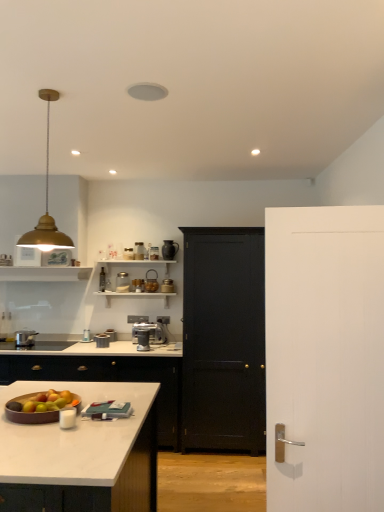
Measure the distance between point (65,238) and camera.

Point (65,238) and camera are 10.34 feet apart.

How much space does clear glass jar at upper center, marked as the fifth appliance in a right-to-left arrangement, occupy vertically?

It is 22.04 centimeters.

Identify the location of metallic silver toaster at upper center, positioned as the 8th appliance in right-to-left order. This screenshot has width=384, height=512. (102, 280).

What do you see at coordinates (44, 402) in the screenshot? The height and width of the screenshot is (512, 384). I see `green matte apple at lower left` at bounding box center [44, 402].

What is the approximate width of metallic silver canister at center, acting as the 7th appliance starting from the right?

5.71 inches.

This screenshot has width=384, height=512. What do you see at coordinates (102, 340) in the screenshot?
I see `metallic silver canister at center, which is the 2th appliance in left-to-right order` at bounding box center [102, 340].

Identify the location of metallic silver toaster at center, the 5th appliance viewed from the left. (128, 254).

Locate an element on the screen. metallic silver toaster at center, which appears as the 6th appliance when viewed from the right is located at coordinates (111, 334).

Find the location of `gold metallic pendant light at upper left`. gold metallic pendant light at upper left is located at coordinates (46, 203).

Which object is further away from the camera taking this photo, black wooden door at center, marked as the 1th door in a back-to-front arrangement, or green matte apple at lower left?

black wooden door at center, marked as the 1th door in a back-to-front arrangement, is more distant.

Does point (216, 253) come behind point (9, 409)?

Yes.

This screenshot has width=384, height=512. I want to click on apple that is on the left side of black wooden door at center, which is counted as the second door, starting from the front, so click(x=44, y=402).

In terms of width, does green matte apple at lower left look wider or thinner when compared to gold metallic pendant light at upper left?

Considering their sizes, green matte apple at lower left looks broader than gold metallic pendant light at upper left.

How many degrees apart are the facing directions of green matte apple at lower left and gold metallic pendant light at upper left?

The angle between the facing direction of green matte apple at lower left and the facing direction of gold metallic pendant light at upper left is 2.22 degrees.

Which object is more forward, green matte apple at lower left or gold metallic pendant light at upper left?

green matte apple at lower left is closer to the camera.

From the picture: Is green matte apple at lower left directly adjacent to gold metallic pendant light at upper left?

No, green matte apple at lower left is not beside gold metallic pendant light at upper left.

From a real-world perspective, is satin silver coffee machine at center physically above white glossy countertop at lower left?

Indeed, from a real-world perspective, satin silver coffee machine at center stands above white glossy countertop at lower left.

Considering the sizes of objects satin silver coffee machine at center and white glossy countertop at lower left in the image provided, who is thinner, satin silver coffee machine at center or white glossy countertop at lower left?

satin silver coffee machine at center is thinner.

Can you confirm if satin silver coffee machine at center is smaller than white glossy countertop at lower left?

Yes, satin silver coffee machine at center is smaller than white glossy countertop at lower left.

Is there a large distance between white wood door at right, marked as the 1th door in a front-to-back arrangement, and metallic silver toaster at center, the 5th appliance viewed from the left?

white wood door at right, marked as the 1th door in a front-to-back arrangement, is positioned a significant distance from metallic silver toaster at center, the 5th appliance viewed from the left.

From the image's perspective, relative to metallic silver toaster at center, the 4th appliance viewed from the right, is white wood door at right, which ranks as the second door in back-to-front order, above or below?

white wood door at right, which ranks as the second door in back-to-front order, is situated lower than metallic silver toaster at center, the 4th appliance viewed from the right, in the image.

Where is `the 4th appliance counting from the left of the white wood door at right, which ranks as the second door in back-to-front order`? the 4th appliance counting from the left of the white wood door at right, which ranks as the second door in back-to-front order is located at coordinates (128, 254).

Is point (381, 220) behind point (125, 252)?

That is False.

Between matte silver pot at left and metallic silver toaster at center, which appears as the 6th appliance when viewed from the right, which one has larger width?

With larger width is matte silver pot at left.

Considering the positions of points (26, 330) and (105, 331), is point (26, 330) closer to camera compared to point (105, 331)?

No, (26, 330) is further to viewer.

Is matte silver pot at left next to metallic silver toaster at center, arranged as the 3th appliance when viewed from the left?

No.

From the image's perspective, does matte silver pot at left appear higher than metallic silver toaster at center, arranged as the 3th appliance when viewed from the left?

Correct, matte silver pot at left appears higher than metallic silver toaster at center, arranged as the 3th appliance when viewed from the left, in the image.

Which is farther, (119, 277) or (202, 327)?

The point (119, 277) is farther from the camera.

Is clear glass jar at upper center, marked as the 4th appliance in a left-to-right arrangement, at the left side of black wooden door at center, which is counted as the second door, starting from the front?

Indeed, clear glass jar at upper center, marked as the 4th appliance in a left-to-right arrangement, is positioned on the left side of black wooden door at center, which is counted as the second door, starting from the front.

Considering the relative sizes of clear glass jar at upper center, marked as the fifth appliance in a right-to-left arrangement, and black wooden door at center, which is counted as the second door, starting from the front, in the image provided, is clear glass jar at upper center, marked as the fifth appliance in a right-to-left arrangement, smaller than black wooden door at center, which is counted as the second door, starting from the front,?

Yes.

Is point (170, 245) positioned after point (236, 436)?

Yes, it is behind point (236, 436).

Which of these two, matte black coffee maker at upper center, the eighth appliance when ordered from left to right, or black wooden door at center, which is counted as the second door, starting from the front, stands taller?

black wooden door at center, which is counted as the second door, starting from the front.

From the image's perspective, relative to black wooden door at center, which is counted as the second door, starting from the front, is matte black coffee maker at upper center, the eighth appliance when ordered from left to right, above or below?

matte black coffee maker at upper center, the eighth appliance when ordered from left to right, is situated higher than black wooden door at center, which is counted as the second door, starting from the front, in the image.

How much distance is there between matte black coffee maker at upper center, the 1th appliance in the right-to-left sequence, and black wooden door at center, which is counted as the second door, starting from the front?

The distance of matte black coffee maker at upper center, the 1th appliance in the right-to-left sequence, from black wooden door at center, which is counted as the second door, starting from the front, is 3.83 feet.

Image resolution: width=384 pixels, height=512 pixels. Identify the location of the 1st door directly above the green matte apple at lower left (from a real-world perspective). (223, 340).

This screenshot has height=512, width=384. In order to click on light fixture above the green matte apple at lower left (from the image's perspective) in this screenshot , I will do `click(46, 203)`.

Estimate the real-world distances between objects in this image. Which object is further from white wood door at right, marked as the 1th door in a front-to-back arrangement, metallic silver toaster at center, the 5th appliance viewed from the left, or metallic silver canister at center, which is the 2th appliance in left-to-right order?

metallic silver toaster at center, the 5th appliance viewed from the left, lies further to white wood door at right, marked as the 1th door in a front-to-back arrangement, than the other object.

Estimate the real-world distances between objects in this image. Which object is closer to white glossy countertop at lower left, metallic silver canister at upper center, the 7th appliance when ordered from left to right, or metallic silver canister at center, which is the 2th appliance in left-to-right order?

Based on the image, metallic silver canister at center, which is the 2th appliance in left-to-right order, appears to be nearer to white glossy countertop at lower left.

Estimate the real-world distances between objects in this image. Which object is further from white wood door at right, which ranks as the second door in back-to-front order, green matte apple at lower left or metallic silver canister at upper center, which is the 2th appliance in right-to-left order?

metallic silver canister at upper center, which is the 2th appliance in right-to-left order, lies further to white wood door at right, which ranks as the second door in back-to-front order, than the other object.

Which object lies nearer to the anchor point white glossy countertop at lower left, satin silver coffee machine at center or matte silver pot at left?

Based on the image, satin silver coffee machine at center appears to be nearer to white glossy countertop at lower left.

Looking at the image, which one is located further to metallic silver toaster at upper center, positioned as the 8th appliance in right-to-left order, matte black coffee maker at upper center, the eighth appliance when ordered from left to right, or metallic silver toaster at center, the 5th appliance viewed from the left?

Among the two, matte black coffee maker at upper center, the eighth appliance when ordered from left to right, is located further to metallic silver toaster at upper center, positioned as the 8th appliance in right-to-left order.

Which object lies nearer to the anchor point matte black coffee maker at upper center, the 1th appliance in the right-to-left sequence, white glossy countertop at lower left or clear glass jar at upper center, marked as the 4th appliance in a left-to-right arrangement?

clear glass jar at upper center, marked as the 4th appliance in a left-to-right arrangement, is positioned closer to the anchor matte black coffee maker at upper center, the 1th appliance in the right-to-left sequence.

Estimate the real-world distances between objects in this image. Which object is further from metallic silver toaster at center, the 5th appliance viewed from the left, clear glass jar at upper center, marked as the 4th appliance in a left-to-right arrangement, or black wooden door at center, marked as the 1th door in a back-to-front arrangement?

black wooden door at center, marked as the 1th door in a back-to-front arrangement.

Looking at the image, which one is located further to white wood door at right, which ranks as the second door in back-to-front order, matte silver pot at left or white marble countertop at center?

Among the two, matte silver pot at left is located further to white wood door at right, which ranks as the second door in back-to-front order.

This screenshot has height=512, width=384. I want to click on coffee machine between white wood door at right, which ranks as the second door in back-to-front order, and metallic silver canister at upper center, the 7th appliance when ordered from left to right, from front to back, so click(x=144, y=335).

Identify the location of coffee machine between clear glass jar at upper center, marked as the 4th appliance in a left-to-right arrangement, and black wooden door at center, marked as the 1th door in a back-to-front arrangement. (144, 335).

Identify the location of apple located between white marble countertop at center and metallic silver toaster at upper center, positioned as the 8th appliance in right-to-left order, in the depth direction. This screenshot has height=512, width=384. (44, 402).

At what (x,y) coordinates should I click in order to perform the action: click on coffee machine between green matte apple at lower left and metallic silver toaster at center, the 4th appliance viewed from the right, along the z-axis. Please return your answer as a coordinate pair (x, y). Looking at the image, I should click on (144, 335).